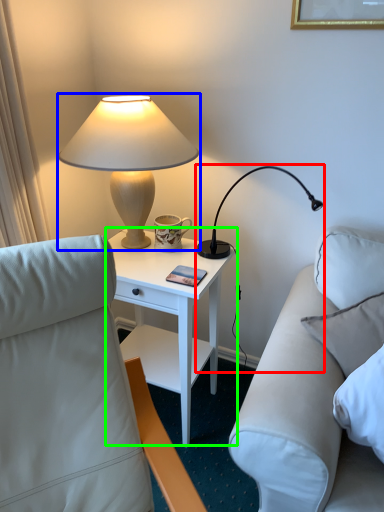
Question: Estimate the real-world distances between objects in this image. Which object is closer to lamp (highlighted by a red box), lamp (highlighted by a blue box) or nightstand (highlighted by a green box)?

Choices:
 (A) lamp
 (B) nightstand

Answer: (B)